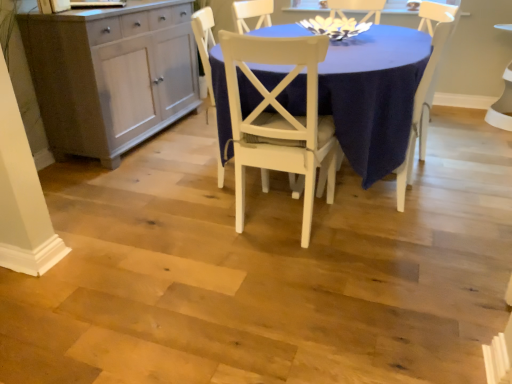
Describe the element at coordinates (111, 76) in the screenshot. This screenshot has width=512, height=384. I see `matte gray cabinet at left` at that location.

Describe the element at coordinates (426, 86) in the screenshot. The image size is (512, 384). I see `white wood chair at center, which is counted as the 3th chair, starting from the left` at that location.

The image size is (512, 384). What do you see at coordinates (374, 95) in the screenshot? I see `matte white table at center` at bounding box center [374, 95].

You are a GUI agent. You are given a task and a screenshot of the screen. Output one action in this format:
    pyautogui.click(x=<x>, y=<y>)
    Task: Click on the white matte chair at center, which is the 2th chair in left-to-right order
    Image resolution: width=512 pixels, height=384 pixels.
    Given the screenshot: What is the action you would take?
    pos(280,121)

From the image's perspective, is white matte chair at center, which is the 2th chair in left-to-right order, over matte gray cabinet at left?

Actually, white matte chair at center, which is the 2th chair in left-to-right order, appears below matte gray cabinet at left in the image.

Who is smaller, white matte chair at center, which is the 2th chair in left-to-right order, or matte gray cabinet at left?

With smaller size is white matte chair at center, which is the 2th chair in left-to-right order.

Does white matte chair at center, positioned as the second chair in right-to-left order, appear on the right side of matte gray cabinet at left?

Indeed, white matte chair at center, positioned as the second chair in right-to-left order, is positioned on the right side of matte gray cabinet at left.

In the scene shown: How distant is white matte chair at center, positioned as the second chair in right-to-left order, from matte gray cabinet at left?

white matte chair at center, positioned as the second chair in right-to-left order, and matte gray cabinet at left are 4.19 feet apart from each other.

In terms of height, does white wood chair at center, which is counted as the 3th chair, starting from the left, look taller or shorter compared to matte gray cabinet at left?

In the image, white wood chair at center, which is counted as the 3th chair, starting from the left, appears to be taller than matte gray cabinet at left.

How different are the orientations of white wood chair at center, which ranks as the first chair in right-to-left order, and matte gray cabinet at left in degrees?

The angular difference between white wood chair at center, which ranks as the first chair in right-to-left order, and matte gray cabinet at left is 160 degrees.

From the image's perspective, who appears lower, white wood chair at center, which ranks as the first chair in right-to-left order, or matte gray cabinet at left?

white wood chair at center, which ranks as the first chair in right-to-left order, appears lower in the image.

From the picture: Who is taller, white matte chair at center, positioned as the second chair in right-to-left order, or white wood chair at center, which ranks as the first chair in right-to-left order?

With more height is white wood chair at center, which ranks as the first chair in right-to-left order.

Is white matte chair at center, positioned as the second chair in right-to-left order, facing towards white wood chair at center, which is counted as the 3th chair, starting from the left?

No, white matte chair at center, positioned as the second chair in right-to-left order, is not turned towards white wood chair at center, which is counted as the 3th chair, starting from the left.

Is white matte chair at center, positioned as the second chair in right-to-left order, situated inside white wood chair at center, which is counted as the 3th chair, starting from the left, or outside?

white matte chair at center, positioned as the second chair in right-to-left order, is not inside white wood chair at center, which is counted as the 3th chair, starting from the left, it's outside.

Is white matte chair at center, which is the 2th chair in left-to-right order, with white wood chair at center, which is counted as the 3th chair, starting from the left?

No, white matte chair at center, which is the 2th chair in left-to-right order, is not in contact with white wood chair at center, which is counted as the 3th chair, starting from the left.

In the scene shown: Considering the relative sizes of matte white table at center and white matte chair at center, which is the 2th chair in left-to-right order, in the image provided, is matte white table at center thinner than white matte chair at center, which is the 2th chair in left-to-right order,?

No.

Is matte white table at center further to camera compared to white matte chair at center, positioned as the second chair in right-to-left order?

Yes, it is.

At what (x,y) coordinates should I click in order to perform the action: click on chair that is the 2nd one when counting downward from the matte white table at center (from the image's perspective). Please return your answer as a coordinate pair (x, y). The image size is (512, 384). Looking at the image, I should click on (280, 121).

Considering the positions of objects matte white table at center and white matte chair at center, which is the 2th chair in left-to-right order, in the image provided, who is more to the right, matte white table at center or white matte chair at center, which is the 2th chair in left-to-right order,?

matte white table at center.

Is white wood chair at center, arranged as the third chair when viewed from the right, positioned in front of matte white table at center?

No, it is not.

Is white wood chair at center, arranged as the third chair when viewed from the right, next to matte white table at center?

They are not placed beside each other.

The width and height of the screenshot is (512, 384). Identify the location of the 1st chair behind the matte white table at center. (205, 44).

In the scene shown: Would you say white wood chair at center, arranged as the third chair when viewed from the right, contains matte white table at center?

No, matte white table at center is not inside white wood chair at center, arranged as the third chair when viewed from the right.

Could you tell me if matte gray cabinet at left is turned towards white matte chair at center, which is the 2th chair in left-to-right order?

Yes, matte gray cabinet at left is oriented towards white matte chair at center, which is the 2th chair in left-to-right order.

From a real-world perspective, is matte gray cabinet at left physically located above or below white matte chair at center, positioned as the second chair in right-to-left order?

matte gray cabinet at left is below white matte chair at center, positioned as the second chair in right-to-left order.

Is matte gray cabinet at left bigger than white matte chair at center, which is the 2th chair in left-to-right order?

Correct, matte gray cabinet at left is larger in size than white matte chair at center, which is the 2th chair in left-to-right order.

Which is more to the right, matte gray cabinet at left or white matte chair at center, which is the 2th chair in left-to-right order?

From the viewer's perspective, white matte chair at center, which is the 2th chair in left-to-right order, appears more on the right side.

From the image's perspective, is white wood chair at center, arranged as the third chair when viewed from the right, above white matte chair at center, which is the 2th chair in left-to-right order?

Yes, from the image's perspective, white wood chair at center, arranged as the third chair when viewed from the right, is above white matte chair at center, which is the 2th chair in left-to-right order.

Is white wood chair at center, arranged as the third chair when viewed from the right, far away from white matte chair at center, which is the 2th chair in left-to-right order?

No, there isn't a large distance between white wood chair at center, arranged as the third chair when viewed from the right, and white matte chair at center, which is the 2th chair in left-to-right order.

Who is shorter, white wood chair at center, arranged as the third chair when viewed from the right, or white matte chair at center, positioned as the second chair in right-to-left order?

Standing shorter between the two is white matte chair at center, positioned as the second chair in right-to-left order.

From a real-world perspective, is white wood chair at center, arranged as the third chair when viewed from the right, over white matte chair at center, positioned as the second chair in right-to-left order?

No.

Find the location of a particular element. The image size is (512, 384). cabinetry that is under the white matte chair at center, which is the 2th chair in left-to-right order (from a real-world perspective) is located at coordinates (111, 76).

Where is `chair behind the matte gray cabinet at left`? Image resolution: width=512 pixels, height=384 pixels. chair behind the matte gray cabinet at left is located at coordinates (426, 86).

Based on their spatial positions, is white wood chair at center, which ranks as the first chair in right-to-left order, or white matte chair at center, positioned as the second chair in right-to-left order, closer to matte gray cabinet at left?

white matte chair at center, positioned as the second chair in right-to-left order, is closer to matte gray cabinet at left.

When comparing their distances from white matte chair at center, which is the 2th chair in left-to-right order, does matte white table at center or white wood chair at center, which is counted as the 3th chair, starting from the left, seem closer?

The object closer to white matte chair at center, which is the 2th chair in left-to-right order, is matte white table at center.

Estimate the real-world distances between objects in this image. Which object is closer to white matte chair at center, which is the 2th chair in left-to-right order, white wood chair at center, which ranks as the first chair in left-to-right order, or matte gray cabinet at left?

Based on the image, white wood chair at center, which ranks as the first chair in left-to-right order, appears to be nearer to white matte chair at center, which is the 2th chair in left-to-right order.

Based on their spatial positions, is matte white table at center or white wood chair at center, which is counted as the 3th chair, starting from the left, further from white wood chair at center, arranged as the third chair when viewed from the right?

The object further to white wood chair at center, arranged as the third chair when viewed from the right, is white wood chair at center, which is counted as the 3th chair, starting from the left.

Estimate the real-world distances between objects in this image. Which object is closer to white wood chair at center, which ranks as the first chair in left-to-right order, matte white table at center or matte gray cabinet at left?

matte white table at center.

From the image, which object appears to be nearer to white wood chair at center, which ranks as the first chair in left-to-right order, white wood chair at center, which ranks as the first chair in right-to-left order, or white matte chair at center, which is the 2th chair in left-to-right order?

white matte chair at center, which is the 2th chair in left-to-right order.

Considering their positions, is white wood chair at center, which ranks as the first chair in right-to-left order, positioned further to white matte chair at center, which is the 2th chair in left-to-right order, than white wood chair at center, arranged as the third chair when viewed from the right?

white wood chair at center, which ranks as the first chair in right-to-left order, is positioned further to the anchor white matte chair at center, which is the 2th chair in left-to-right order.

Estimate the real-world distances between objects in this image. Which object is further from matte gray cabinet at left, matte white table at center or white matte chair at center, positioned as the second chair in right-to-left order?

Among the two, white matte chair at center, positioned as the second chair in right-to-left order, is located further to matte gray cabinet at left.

The width and height of the screenshot is (512, 384). I want to click on kitchen & dining room table positioned between white matte chair at center, which is the 2th chair in left-to-right order, and white wood chair at center, which is counted as the 3th chair, starting from the left, from near to far, so click(374, 95).

Locate an element on the screen. This screenshot has height=384, width=512. chair located between white wood chair at center, arranged as the third chair when viewed from the right, and white wood chair at center, which ranks as the first chair in right-to-left order, in the left-right direction is located at coordinates (280, 121).

Locate an element on the screen. The width and height of the screenshot is (512, 384). kitchen & dining room table situated between matte gray cabinet at left and white wood chair at center, which ranks as the first chair in right-to-left order, from left to right is located at coordinates (374, 95).

At what (x,y) coordinates should I click in order to perform the action: click on kitchen & dining room table situated between white wood chair at center, arranged as the third chair when viewed from the right, and white wood chair at center, which is counted as the 3th chair, starting from the left, from left to right. Please return your answer as a coordinate pair (x, y). The image size is (512, 384). Looking at the image, I should click on (374, 95).